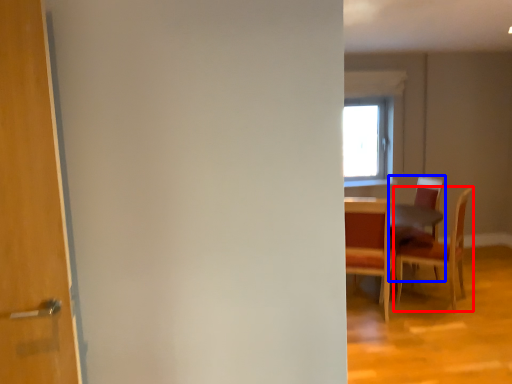
Question: Which point is closer to the camera, chair (highlighted by a red box) or chair (highlighted by a blue box)?

Choices:
 (A) chair
 (B) chair

Answer: (A)